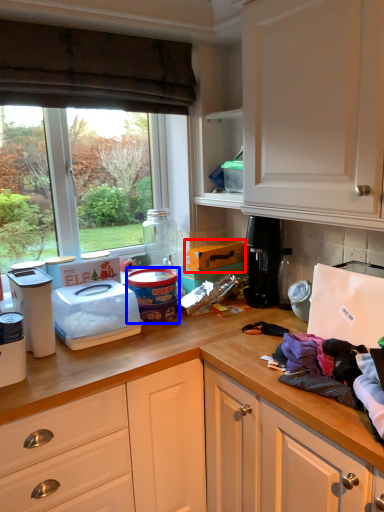
Question: Which point is further to the camera, cardboard box (highlighted by a red box) or appliance (highlighted by a blue box)?

Choices:
 (A) cardboard box
 (B) appliance

Answer: (A)